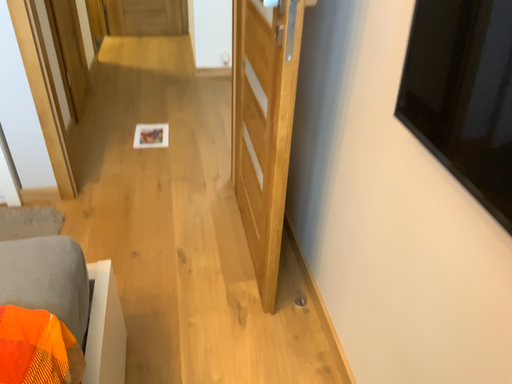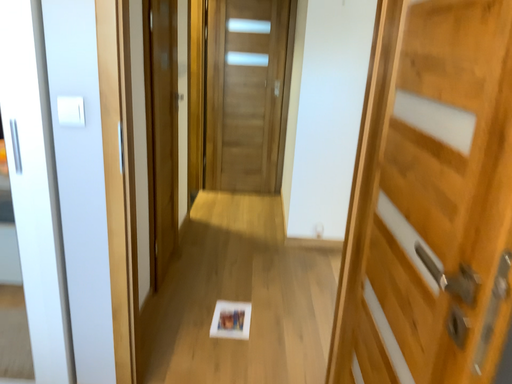
Question: Which way did the camera rotate in the video?

Choices:
 (A) rotated upward
 (B) rotated downward

Answer: (A)